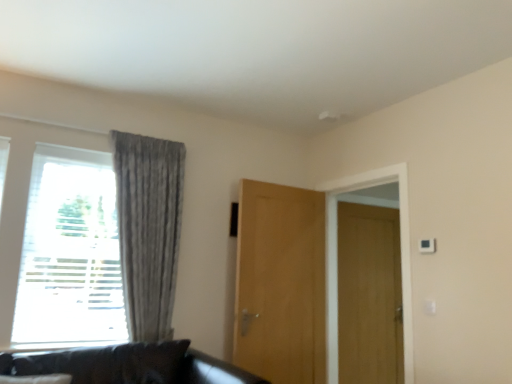
Question: Is gray textured curtain at left a part of wooden door at right, placed as the 1th door when sorted from back to front?

Choices:
 (A) no
 (B) yes

Answer: (A)

Question: Is wooden door at right, which ranks as the 2th door in left-to-right order, not near gray textured curtain at left?

Choices:
 (A) yes
 (B) no

Answer: (A)

Question: Is wooden door at right, which ranks as the 2th door in left-to-right order, wider than gray textured curtain at left?

Choices:
 (A) no
 (B) yes

Answer: (A)

Question: Can you confirm if wooden door at right, the second door viewed from the front, is shorter than gray textured curtain at left?

Choices:
 (A) no
 (B) yes

Answer: (A)

Question: Considering the relative positions of wooden door at right, placed as the 1th door when sorted from back to front, and gray textured curtain at left in the image provided, is wooden door at right, placed as the 1th door when sorted from back to front, in front of gray textured curtain at left?

Choices:
 (A) yes
 (B) no

Answer: (B)

Question: From the image's perspective, is gray textured curtain at left located above or below wooden door at right, placed as the 1th door when sorted from back to front?

Choices:
 (A) above
 (B) below

Answer: (A)

Question: Based on their positions, is gray textured curtain at left located to the left or right of wooden door at right, which ranks as the 2th door in left-to-right order?

Choices:
 (A) right
 (B) left

Answer: (B)

Question: Looking at their shapes, would you say gray textured curtain at left is wider or thinner than wooden door at right, which ranks as the 2th door in left-to-right order?

Choices:
 (A) thin
 (B) wide

Answer: (B)

Question: Is point (140, 271) positioned closer to the camera than point (388, 251)?

Choices:
 (A) closer
 (B) farther

Answer: (A)

Question: Would you say gray textured curtain at left is inside or outside light brown wood door at center, the second door in the right-to-left sequence?

Choices:
 (A) inside
 (B) outside

Answer: (B)

Question: Is gray textured curtain at left wider or thinner than light brown wood door at center, the 1th door viewed from the left?

Choices:
 (A) wide
 (B) thin

Answer: (A)

Question: From the image's perspective, is gray textured curtain at left positioned above or below light brown wood door at center, the second door when ordered from back to front?

Choices:
 (A) above
 (B) below

Answer: (A)

Question: From their relative heights in the image, would you say gray textured curtain at left is taller or shorter than light brown wood door at center, the second door in the right-to-left sequence?

Choices:
 (A) short
 (B) tall

Answer: (A)

Question: In terms of height, does wooden door at right, placed as the 1th door when sorted from back to front, look taller or shorter compared to gray textured curtain at left?

Choices:
 (A) short
 (B) tall

Answer: (B)

Question: Considering their positions, is wooden door at right, which ranks as the 2th door in left-to-right order, located in front of or behind gray textured curtain at left?

Choices:
 (A) front
 (B) behind

Answer: (B)